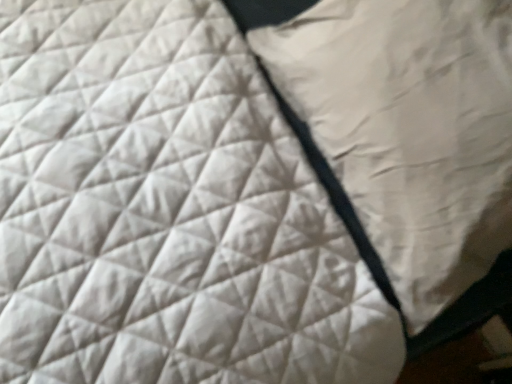
Describe the element at coordinates (409, 130) in the screenshot. I see `white quilted fabric at upper right` at that location.

Identify the location of white quilted fabric at upper right. Image resolution: width=512 pixels, height=384 pixels. (409, 130).

Locate an element on the screen. The image size is (512, 384). white quilted fabric at upper right is located at coordinates (409, 130).